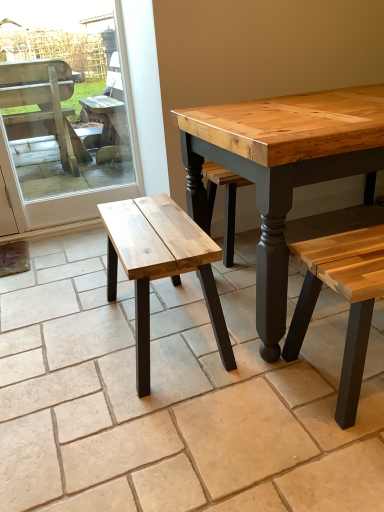
At what (x,y) coordinates should I click in order to perform the action: click on free location in front of natural wood bench at center. Please return your answer as a coordinate pair (x, y). Image resolution: width=384 pixels, height=512 pixels. Looking at the image, I should click on (162, 428).